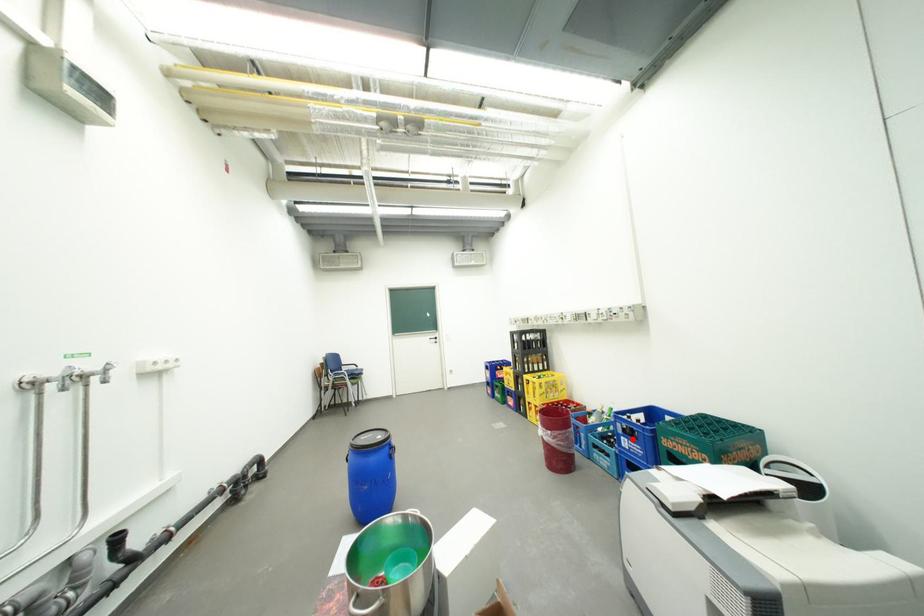
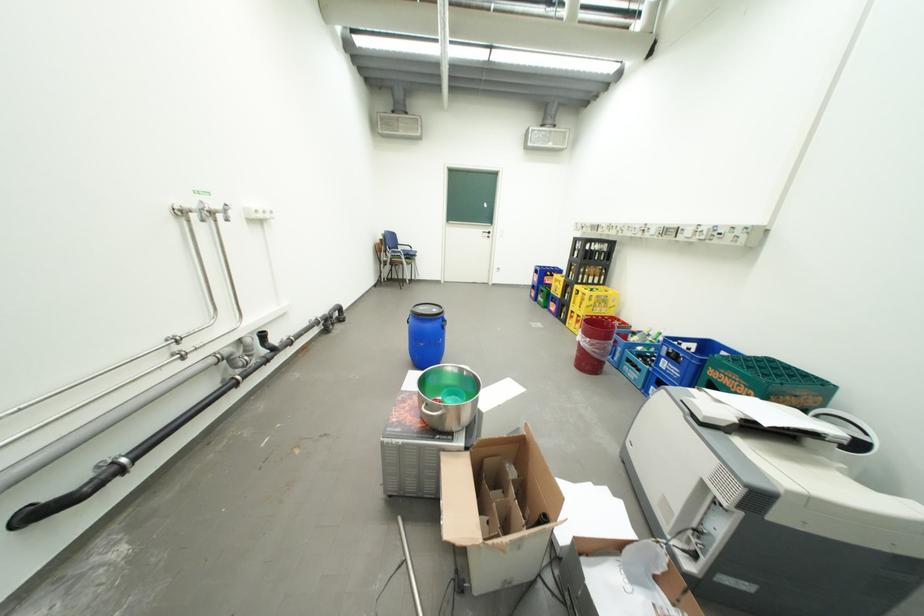
Locate, in the second image, the point that corresponds to the highlighted location in the first image.

(674, 361)